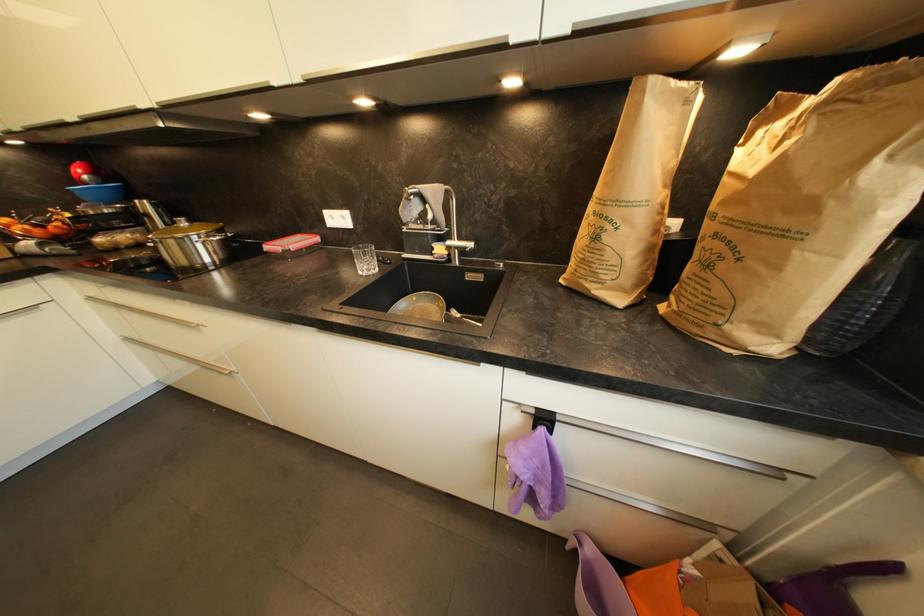
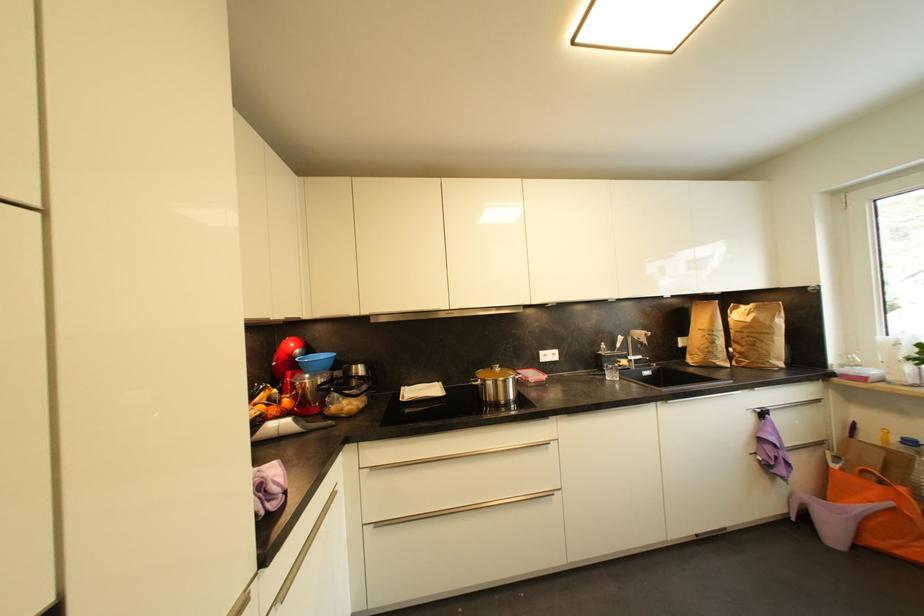
The point at (730, 204) is marked in the first image. Where is the corresponding point in the second image?

(748, 330)